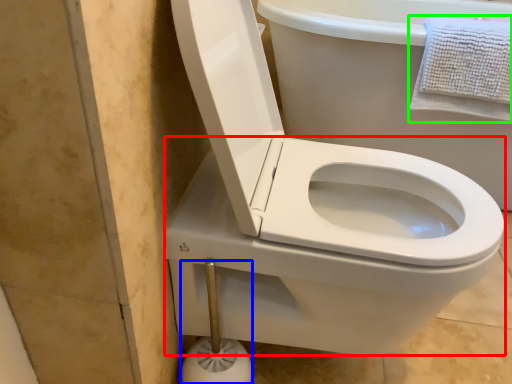
Question: Which is farther away from bidet (highlighted by a red box)? towel bar (highlighted by a blue box) or bath towel (highlighted by a green box)?

Choices:
 (A) towel bar
 (B) bath towel

Answer: (B)